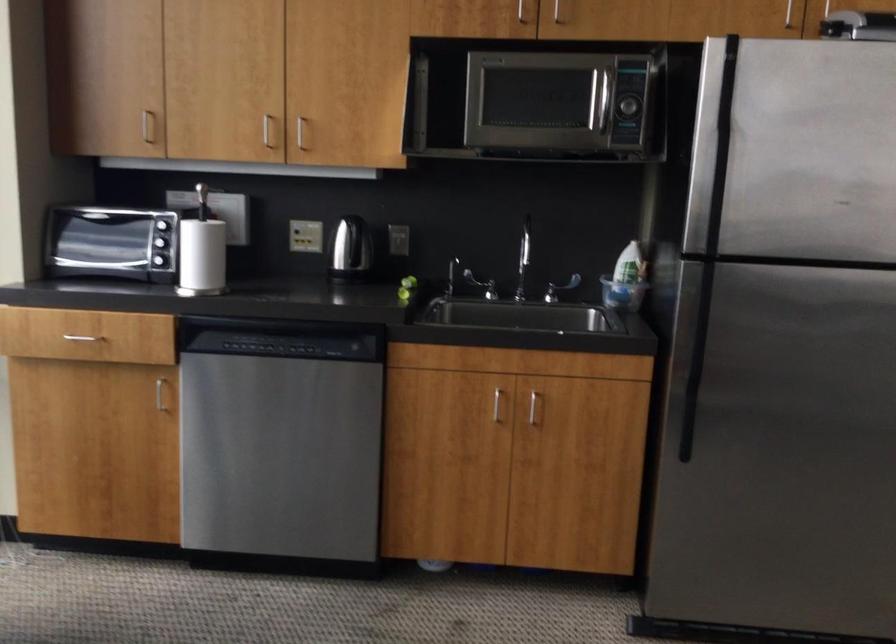
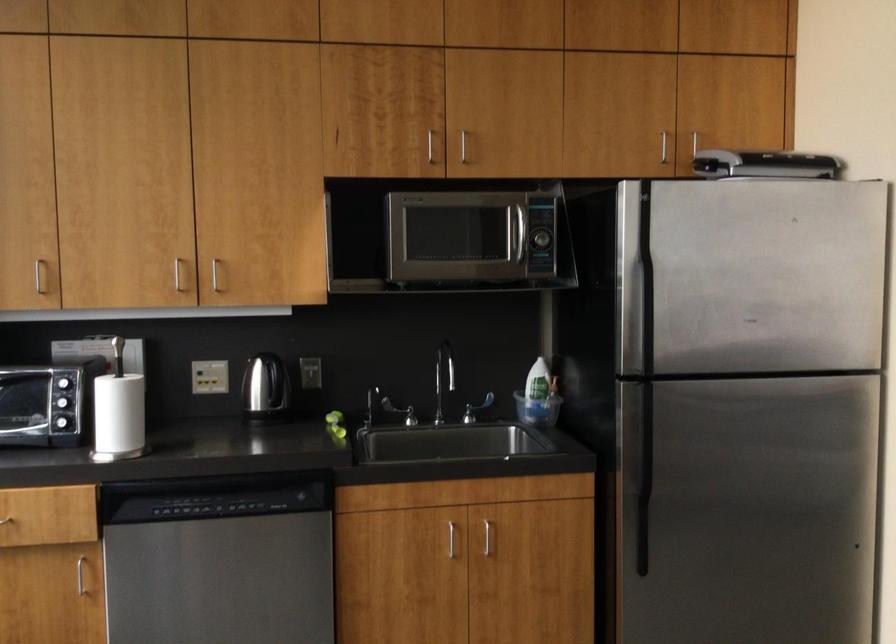
Find the pixel in the second image that matches pixel 531 247 in the first image.

(444, 371)